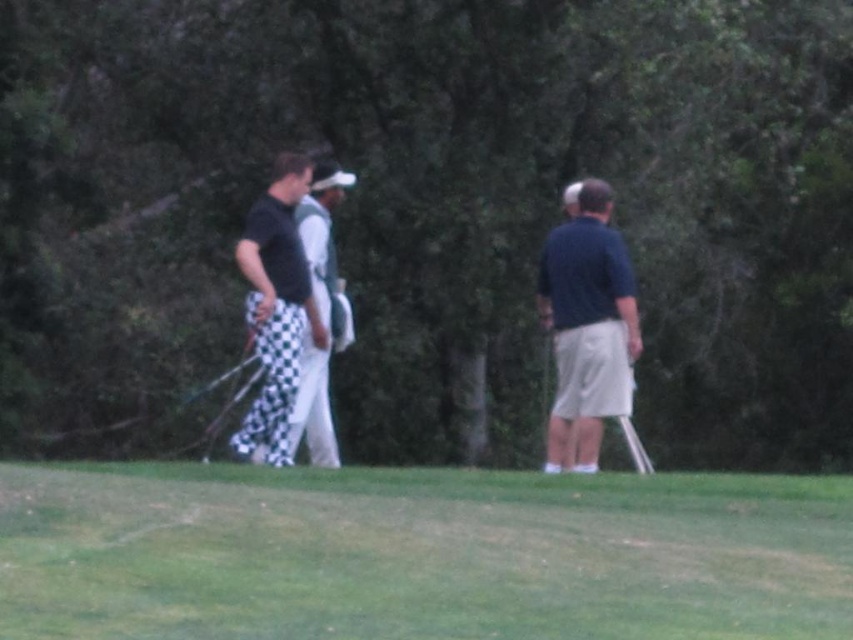
Can you confirm if dark blue fabric shirt at center is positioned above metallic silver golf club at right?

Correct, dark blue fabric shirt at center is located above metallic silver golf club at right.

This screenshot has width=853, height=640. I want to click on dark blue fabric shirt at center, so click(587, 328).

Does dark blue fabric shirt at center appear on the right side of checkered pants at center?

Indeed, dark blue fabric shirt at center is positioned on the right side of checkered pants at center.

Is the position of dark blue fabric shirt at center less distant than that of checkered pants at center?

No, it is behind checkered pants at center.

Is point (612, 346) more distant than point (293, 324)?

That is True.

I want to click on dark blue fabric shirt at center, so click(587, 328).

Does green grass at lower center appear under metallic silver golf club at right?

Yes.

Between green grass at lower center and metallic silver golf club at right, which one has less height?

green grass at lower center

Does point (138, 497) come farther from viewer compared to point (645, 458)?

No, it is not.

Identify the location of green grass at lower center. The height and width of the screenshot is (640, 853). click(418, 554).